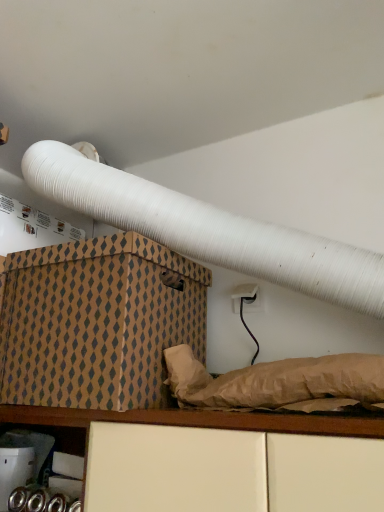
Image resolution: width=384 pixels, height=512 pixels. What are the coordinates of `metallic silver canisters at lower left` in the screenshot? It's located at (52, 474).

What do you see at coordinates (52, 474) in the screenshot? I see `metallic silver canisters at lower left` at bounding box center [52, 474].

Where is `brown cardboard box at lower left`? The image size is (384, 512). brown cardboard box at lower left is located at coordinates (96, 322).

This screenshot has width=384, height=512. What do you see at coordinates (96, 322) in the screenshot? I see `brown cardboard box at lower left` at bounding box center [96, 322].

I want to click on metallic silver canisters at lower left, so click(x=52, y=474).

Considering the positions of objects brown cardboard box at lower left and metallic silver canisters at lower left in the image provided, who is more to the left, brown cardboard box at lower left or metallic silver canisters at lower left?

Positioned to the left is metallic silver canisters at lower left.

Is brown cardboard box at lower left positioned in front of metallic silver canisters at lower left?

Yes, brown cardboard box at lower left is closer to the viewer.

Does point (178, 303) come closer to viewer compared to point (46, 464)?

Yes.

From the image's perspective, does brown cardboard box at lower left appear lower than metallic silver canisters at lower left?

No, from the image's perspective, brown cardboard box at lower left is not below metallic silver canisters at lower left.

From a real-world perspective, which object stands above the other?

In real-world perspective, brown cardboard box at lower left is above.

Between brown cardboard box at lower left and metallic silver canisters at lower left, which one has larger width?

brown cardboard box at lower left is wider.

Does brown cardboard box at lower left have a lesser height compared to metallic silver canisters at lower left?

In fact, brown cardboard box at lower left may be taller than metallic silver canisters at lower left.

Looking at the image, does brown cardboard box at lower left seem bigger or smaller compared to metallic silver canisters at lower left?

Clearly, brown cardboard box at lower left is larger in size than metallic silver canisters at lower left.

Is brown cardboard box at lower left spatially inside metallic silver canisters at lower left, or outside of it?

The correct answer is: outside.

Is brown cardboard box at lower left directly adjacent to metallic silver canisters at lower left?

There is a gap between brown cardboard box at lower left and metallic silver canisters at lower left.

Is brown cardboard box at lower left positioned with its back to metallic silver canisters at lower left?

brown cardboard box at lower left is not turned away from metallic silver canisters at lower left.

Can you tell me how much brown cardboard box at lower left and metallic silver canisters at lower left differ in facing direction?

0.402 degrees.

In the image, there is a brown cardboard box at lower left. Identify the location of shelf below it (from the image's perspective). The image size is (384, 512). (52, 474).

Can you confirm if metallic silver canisters at lower left is positioned to the left of brown cardboard box at lower left?

Correct, you'll find metallic silver canisters at lower left to the left of brown cardboard box at lower left.

Is the depth of metallic silver canisters at lower left less than that of brown cardboard box at lower left?

No.

Does point (39, 498) appear closer or farther from the camera than point (194, 270)?

Point (39, 498) is positioned closer to the camera compared to point (194, 270).

In the scene shown: From the image's perspective, is metallic silver canisters at lower left beneath brown cardboard box at lower left?

Correct, metallic silver canisters at lower left appears lower than brown cardboard box at lower left in the image.

From a real-world perspective, is metallic silver canisters at lower left above or below brown cardboard box at lower left?

metallic silver canisters at lower left is situated lower than brown cardboard box at lower left in the real world.

Does metallic silver canisters at lower left have a lesser width compared to brown cardboard box at lower left?

Indeed, metallic silver canisters at lower left has a lesser width compared to brown cardboard box at lower left.

Considering the sizes of objects metallic silver canisters at lower left and brown cardboard box at lower left in the image provided, who is taller, metallic silver canisters at lower left or brown cardboard box at lower left?

brown cardboard box at lower left.

Which of these two, metallic silver canisters at lower left or brown cardboard box at lower left, is bigger?

brown cardboard box at lower left.

Is metallic silver canisters at lower left positioned beyond the bounds of brown cardboard box at lower left?

Indeed, metallic silver canisters at lower left is completely outside brown cardboard box at lower left.

Are metallic silver canisters at lower left and brown cardboard box at lower left located far from each other?

No.

Is metallic silver canisters at lower left oriented towards brown cardboard box at lower left?

No.

How many degrees apart are the facing directions of metallic silver canisters at lower left and brown cardboard box at lower left?

They differ by 0.402 degrees in their facing directions.

Where is `shelf on the left side of brown cardboard box at lower left`? The height and width of the screenshot is (512, 384). shelf on the left side of brown cardboard box at lower left is located at coordinates (52, 474).

Find the location of a particular element. The height and width of the screenshot is (512, 384). box above the metallic silver canisters at lower left (from the image's perspective) is located at coordinates (96, 322).

Image resolution: width=384 pixels, height=512 pixels. Find the location of `box to the right of metallic silver canisters at lower left`. box to the right of metallic silver canisters at lower left is located at coordinates (96, 322).